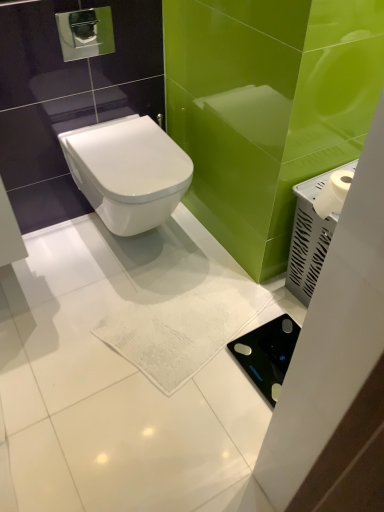
Question: In terms of width, does white plastic tissue holder at right look wider or thinner when compared to white glossy toilet at center?

Choices:
 (A) wide
 (B) thin

Answer: (B)

Question: Is white plastic tissue holder at right to the left or to the right of white glossy toilet at center in the image?

Choices:
 (A) left
 (B) right

Answer: (B)

Question: In terms of height, does white plastic tissue holder at right look taller or shorter compared to white glossy toilet at center?

Choices:
 (A) tall
 (B) short

Answer: (A)

Question: Considering the positions of point coord(168,170) and point coord(291,290), is point coord(168,170) closer or farther from the camera than point coord(291,290)?

Choices:
 (A) closer
 (B) farther

Answer: (A)

Question: From a real-world perspective, is white glossy toilet at center above or below white plastic tissue holder at right?

Choices:
 (A) below
 (B) above

Answer: (B)

Question: Is white glossy toilet at center bigger or smaller than white plastic tissue holder at right?

Choices:
 (A) small
 (B) big

Answer: (B)

Question: Considering the positions of white glossy toilet at center and white plastic tissue holder at right in the image, is white glossy toilet at center taller or shorter than white plastic tissue holder at right?

Choices:
 (A) tall
 (B) short

Answer: (B)